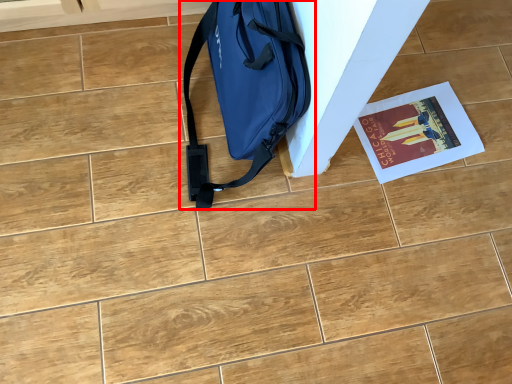
Question: From the image's perspective, where is luggage and bags (annotated by the red box) located relative to magazine?

Choices:
 (A) above
 (B) below

Answer: (A)